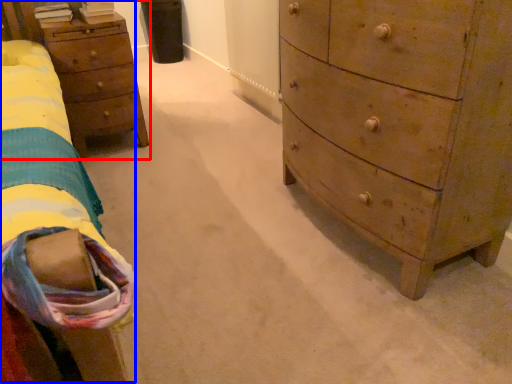
Question: Which object is further to the camera taking this photo, nightstand (highlighted by a red box) or bed (highlighted by a blue box)?

Choices:
 (A) nightstand
 (B) bed

Answer: (A)